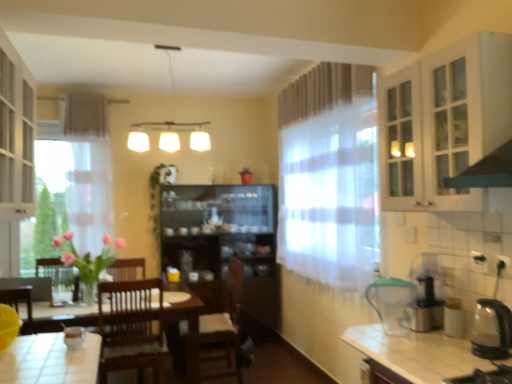
Question: Can you confirm if transparent glass kettle at right, the second appliance when ordered from left to right, is thinner than clear glass cabinet at upper right?

Choices:
 (A) yes
 (B) no

Answer: (B)

Question: Does transparent glass kettle at right, placed as the first appliance when sorted from right to left, have a lesser height compared to clear glass cabinet at upper right?

Choices:
 (A) yes
 (B) no

Answer: (A)

Question: Would you say clear glass cabinet at upper right is part of transparent glass kettle at right, which is counted as the first appliance, starting from the front,'s contents?

Choices:
 (A) no
 (B) yes

Answer: (A)

Question: From a real-world perspective, is transparent glass kettle at right, the second appliance when ordered from left to right, below clear glass cabinet at upper right?

Choices:
 (A) yes
 (B) no

Answer: (A)

Question: Is transparent glass kettle at right, which is counted as the first appliance, starting from the front, taller than clear glass cabinet at upper right?

Choices:
 (A) yes
 (B) no

Answer: (B)

Question: Is point (398, 105) closer or farther from the camera than point (199, 122)?

Choices:
 (A) closer
 (B) farther

Answer: (A)

Question: Considering the positions of clear glass cabinet at upper right and white matte light fixture at upper center in the image, is clear glass cabinet at upper right wider or thinner than white matte light fixture at upper center?

Choices:
 (A) thin
 (B) wide

Answer: (A)

Question: From the image's perspective, is clear glass cabinet at upper right positioned above or below white matte light fixture at upper center?

Choices:
 (A) below
 (B) above

Answer: (A)

Question: Considering the positions of clear glass cabinet at upper right and white matte light fixture at upper center in the image, is clear glass cabinet at upper right taller or shorter than white matte light fixture at upper center?

Choices:
 (A) tall
 (B) short

Answer: (A)

Question: From the image's perspective, is white glass cabinet at left, the second cabinetry when ordered from top to bottom, located above or below brown wooden chair at center?

Choices:
 (A) below
 (B) above

Answer: (B)

Question: From a real-world perspective, is white glass cabinet at left, arranged as the first cabinetry when viewed from the left, positioned above or below brown wooden chair at center?

Choices:
 (A) below
 (B) above

Answer: (B)

Question: Does point (0, 69) appear closer or farther from the camera than point (219, 334)?

Choices:
 (A) closer
 (B) farther

Answer: (A)

Question: Is white glass cabinet at left, the 2th cabinetry ordered from the bottom, situated inside brown wooden chair at center or outside?

Choices:
 (A) inside
 (B) outside

Answer: (B)

Question: Looking at their shapes, would you say white glass cabinet at upper right, which is the first cabinetry in top-to-bottom order, is wider or thinner than transparent glass kettle at right, placed as the first appliance when sorted from right to left?

Choices:
 (A) thin
 (B) wide

Answer: (B)

Question: In terms of height, does white glass cabinet at upper right, which ranks as the third cabinetry in bottom-to-top order, look taller or shorter compared to transparent glass kettle at right, the second appliance when ordered from left to right?

Choices:
 (A) tall
 (B) short

Answer: (A)